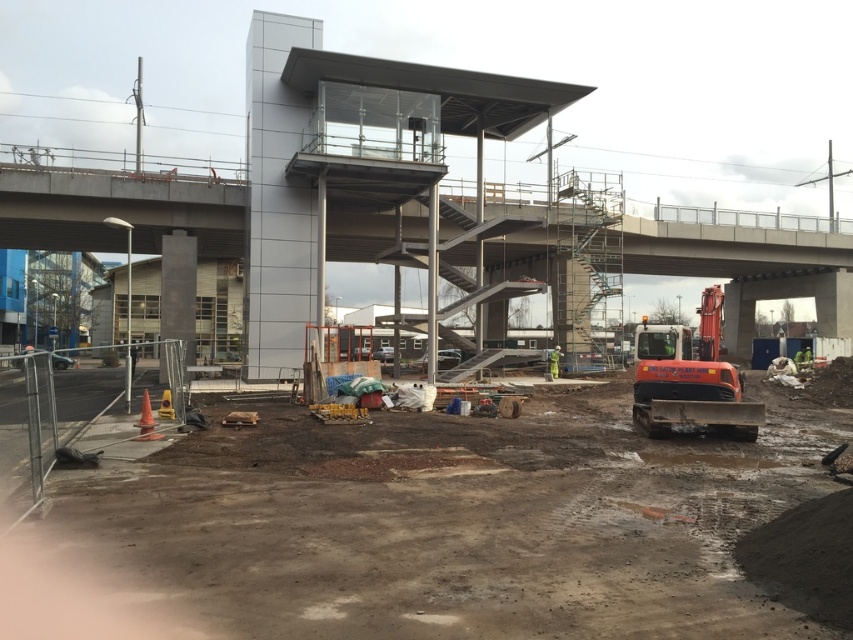
Between point (726, 515) and point (492, 209), which one is positioned in front?

Point (726, 515) is in front.

Can you confirm if muddy dirt at center is positioned above concrete overpass at center?

Actually, muddy dirt at center is below concrete overpass at center.

Which is in front, point (741, 476) or point (194, 186)?

Point (741, 476)

The image size is (853, 640). I want to click on muddy dirt at center, so pyautogui.click(x=483, y=524).

Is muddy dirt at center thinner than orange rubber excavator at lower right?

No, muddy dirt at center is not thinner than orange rubber excavator at lower right.

Who is more forward, (840, 541) or (708, 380)?

Point (840, 541) is in front.

Locate an element on the screen. The image size is (853, 640). muddy dirt at center is located at coordinates (483, 524).

Is point (634, 230) farther from camera compared to point (757, 419)?

Yes, it is behind point (757, 419).

Measure the distance between concrete overpass at center and camera.

concrete overpass at center is 32.00 meters from camera.

Does point (181, 168) lie in front of point (721, 304)?

No, (181, 168) is further to viewer.

Find the location of a particular element. concrete overpass at center is located at coordinates (115, 202).